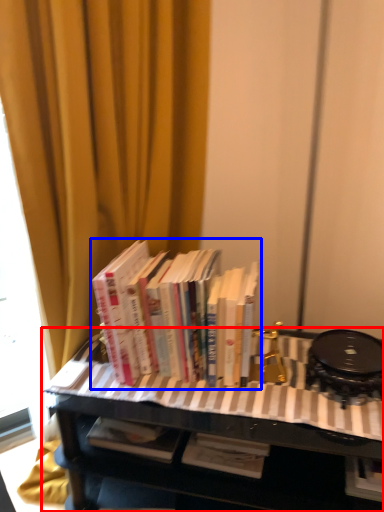
Question: Which of the following is the closest to the observer, table (highlighted by a red box) or book (highlighted by a blue box)?

Choices:
 (A) table
 (B) book

Answer: (A)